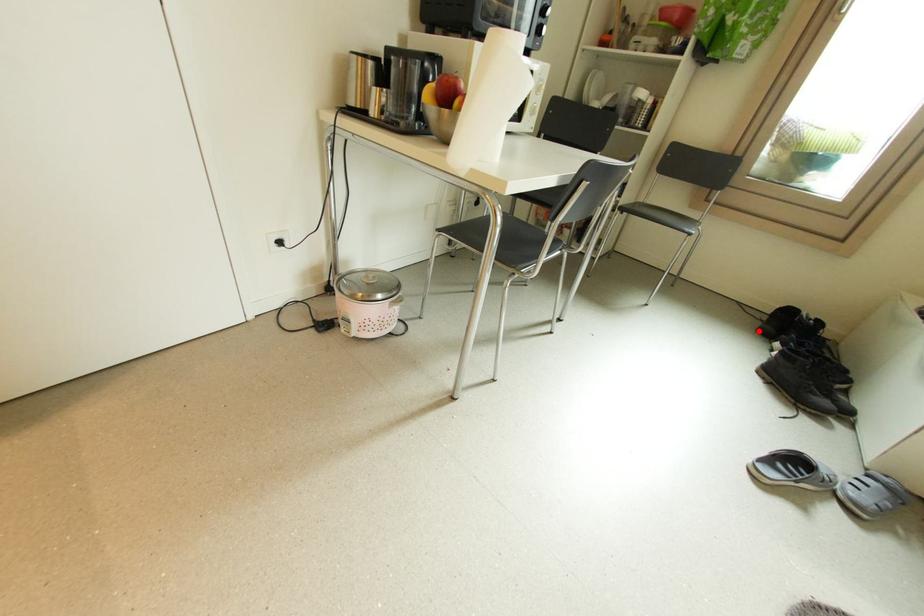
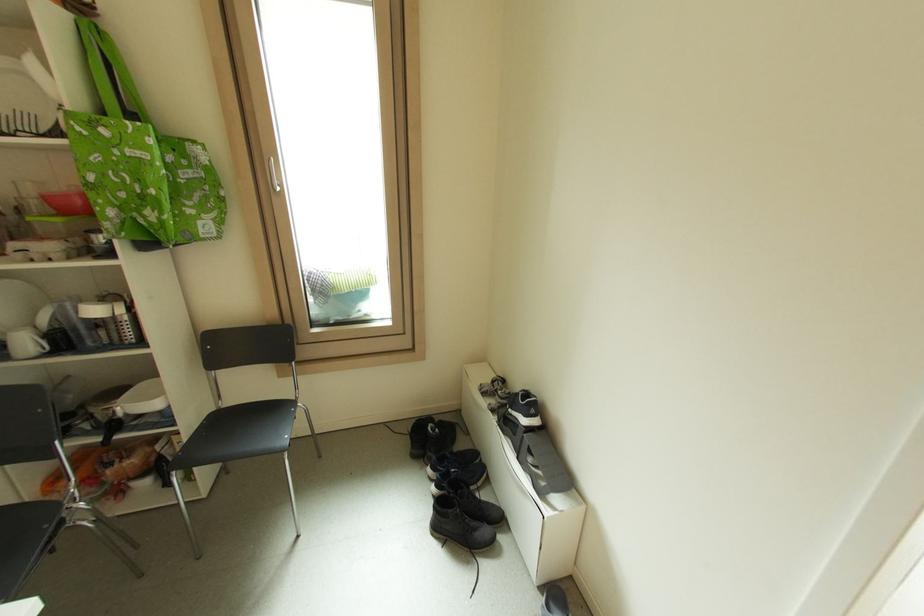
Find the pixel in the second image that matches the highlighted location in the first image.

(415, 456)